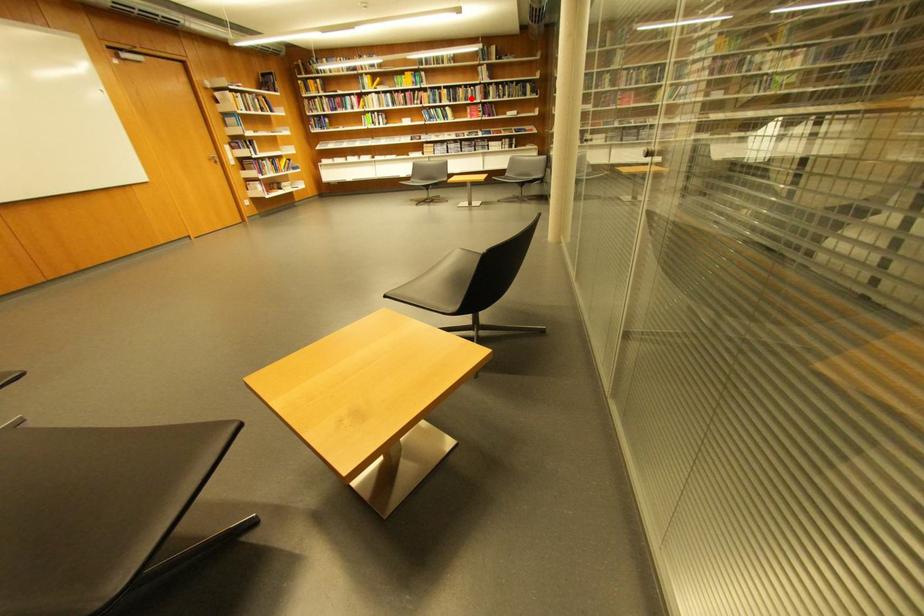
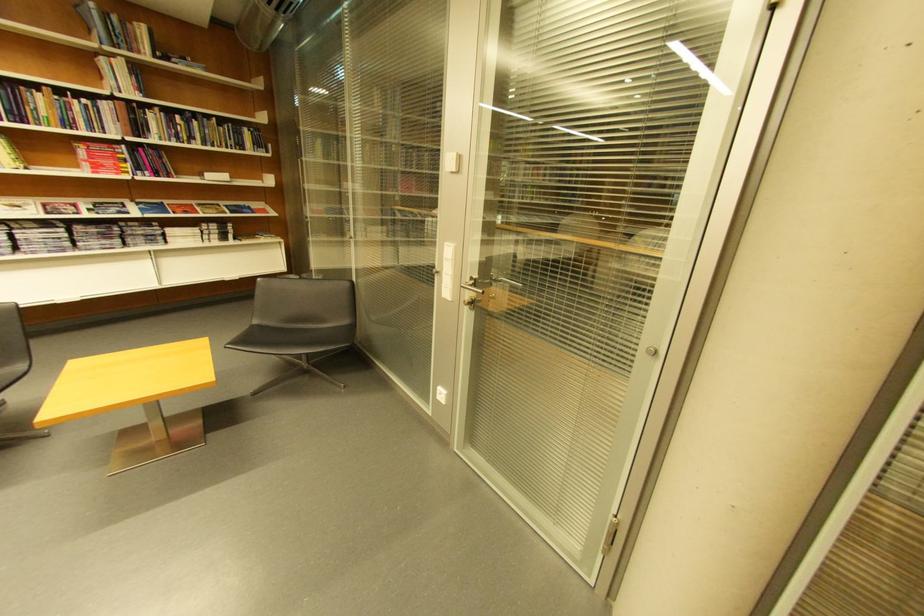
Question: I am providing you with two images of the same scene from different viewpoints. Given a red point in image1, look at the same physical point in image2. Is it:

Choices:
 (A) Closer to the viewpoint
 (B) Farther from the viewpoint

Answer: (B)